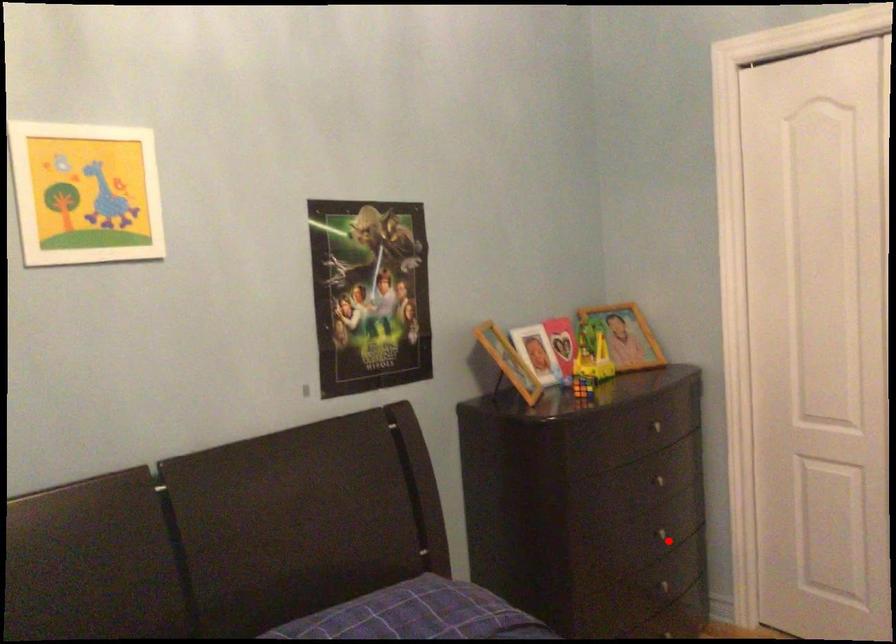
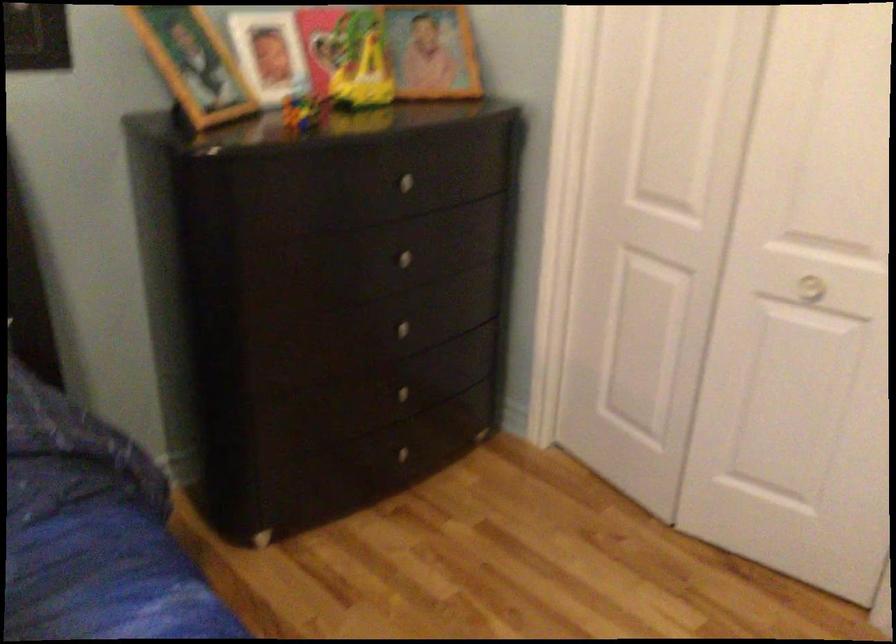
Question: I am providing you with two images of the same scene from different viewpoints. Image1 has a red point marked. In image2, the corresponding 3D location appears at what relative position? Reply with the corresponding letter.

Choices:
 (A) Closer
 (B) Farther

Answer: (A)